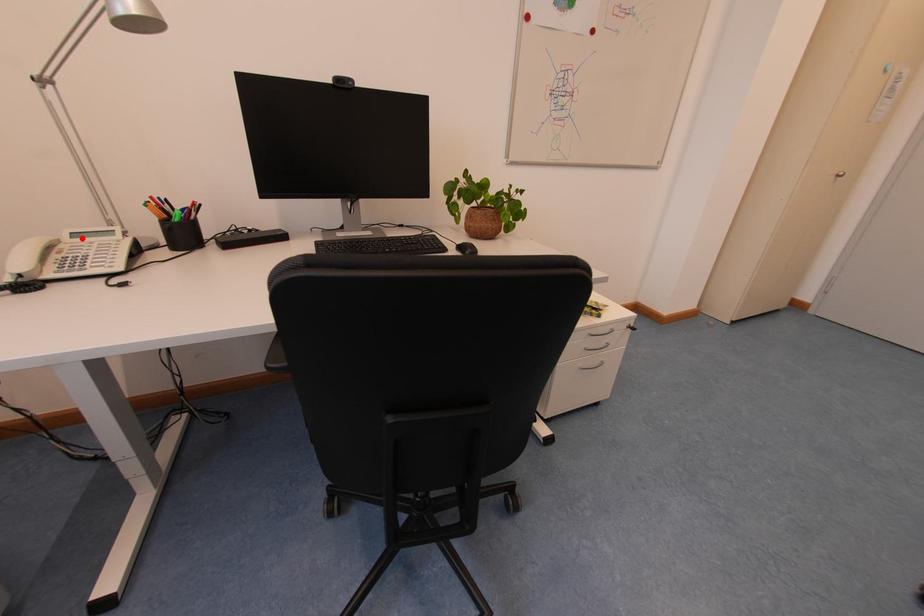
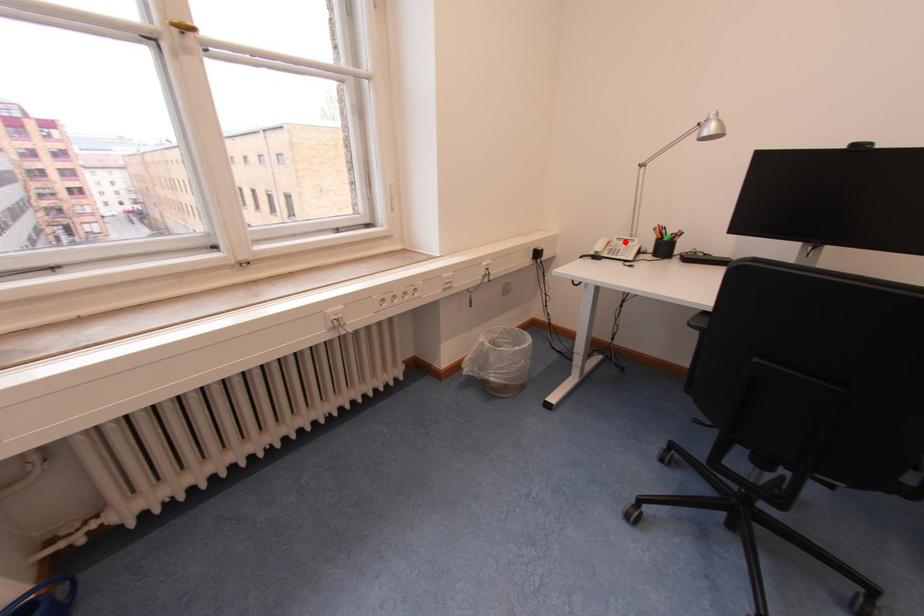
I am providing you with two images of the same scene from different viewpoints. A red point is marked on the first image and another point is marked on the second image. Is the marked point in image1 the same physical position as the marked point in image2?

Yes